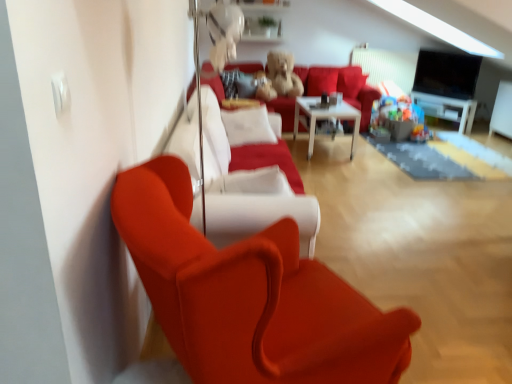
Question: From a real-world perspective, is white glossy entertainment center at right positioned under satin red armchair at left based on gravity?

Choices:
 (A) yes
 (B) no

Answer: (A)

Question: Considering the relative sizes of white glossy entertainment center at right and satin red armchair at left in the image provided, is white glossy entertainment center at right bigger than satin red armchair at left?

Choices:
 (A) yes
 (B) no

Answer: (B)

Question: From the image's perspective, is white glossy entertainment center at right under satin red armchair at left?

Choices:
 (A) yes
 (B) no

Answer: (B)

Question: Is white glossy entertainment center at right completely or partially outside of satin red armchair at left?

Choices:
 (A) no
 (B) yes

Answer: (B)

Question: Does white glossy entertainment center at right have a greater height compared to satin red armchair at left?

Choices:
 (A) no
 (B) yes

Answer: (A)

Question: Is white glossy entertainment center at right thinner than satin red armchair at left?

Choices:
 (A) no
 (B) yes

Answer: (B)

Question: From a real-world perspective, is white glossy entertainment center at right on top of satin red couch at center?

Choices:
 (A) no
 (B) yes

Answer: (A)

Question: Is white glossy entertainment center at right smaller than satin red couch at center?

Choices:
 (A) yes
 (B) no

Answer: (A)

Question: Is white glossy entertainment center at right facing away from satin red couch at center?

Choices:
 (A) no
 (B) yes

Answer: (A)

Question: Is white glossy entertainment center at right wider than satin red couch at center?

Choices:
 (A) no
 (B) yes

Answer: (A)

Question: Is white glossy entertainment center at right positioned before satin red couch at center?

Choices:
 (A) yes
 (B) no

Answer: (B)

Question: Does white glossy entertainment center at right have a lesser width compared to satin red couch at center?

Choices:
 (A) no
 (B) yes

Answer: (B)

Question: Does velvet red couch at center lie behind satin red couch at center?

Choices:
 (A) yes
 (B) no

Answer: (A)